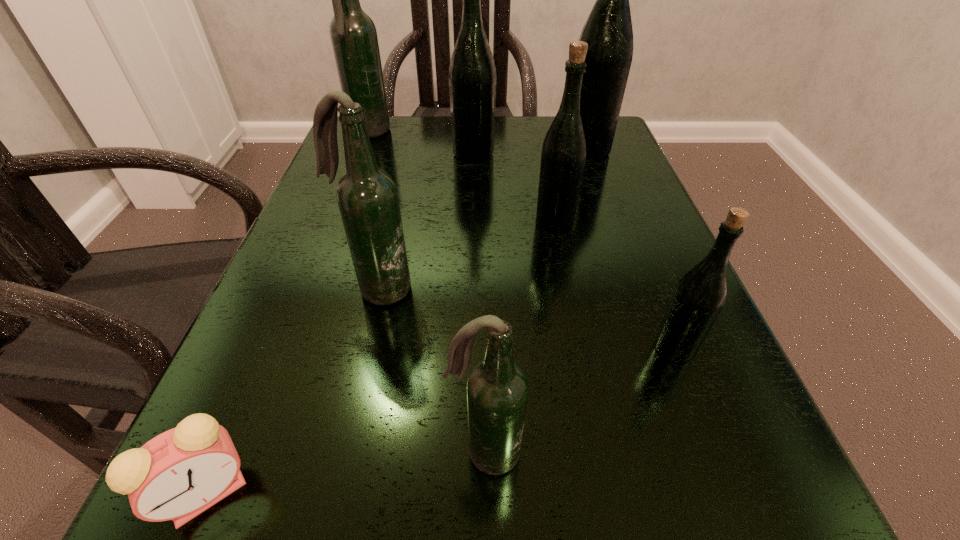
Identify the location of the sixth farthest beer bottle. This screenshot has width=960, height=540. (698, 298).

The height and width of the screenshot is (540, 960). Identify the location of the smallest dark beer bottle. (497, 389).

Find the location of a particular element. The width and height of the screenshot is (960, 540). the nearest beer bottle is located at coordinates (497, 389).

Identify the location of alarm clock. The height and width of the screenshot is (540, 960). (177, 475).

This screenshot has width=960, height=540. In order to click on pink alarm clock in this screenshot , I will do `click(177, 475)`.

Locate an element on the screen. This screenshot has width=960, height=540. free spot located on the back of the tallest object is located at coordinates (579, 129).

The height and width of the screenshot is (540, 960). I want to click on vacant position located 0.360m on the right of the leftmost dark beer bottle, so click(x=542, y=134).

Where is `vacant space situated 0.240m on the right of the second biggest green beer bottle`? Image resolution: width=960 pixels, height=540 pixels. vacant space situated 0.240m on the right of the second biggest green beer bottle is located at coordinates (604, 154).

Identify the location of free space located on the left of the fourth farthest object. The image size is (960, 540). (445, 221).

The image size is (960, 540). What are the coordinates of `free region located 0.220m on the front of the second smallest dark beer bottle` in the screenshot? It's located at point(339,456).